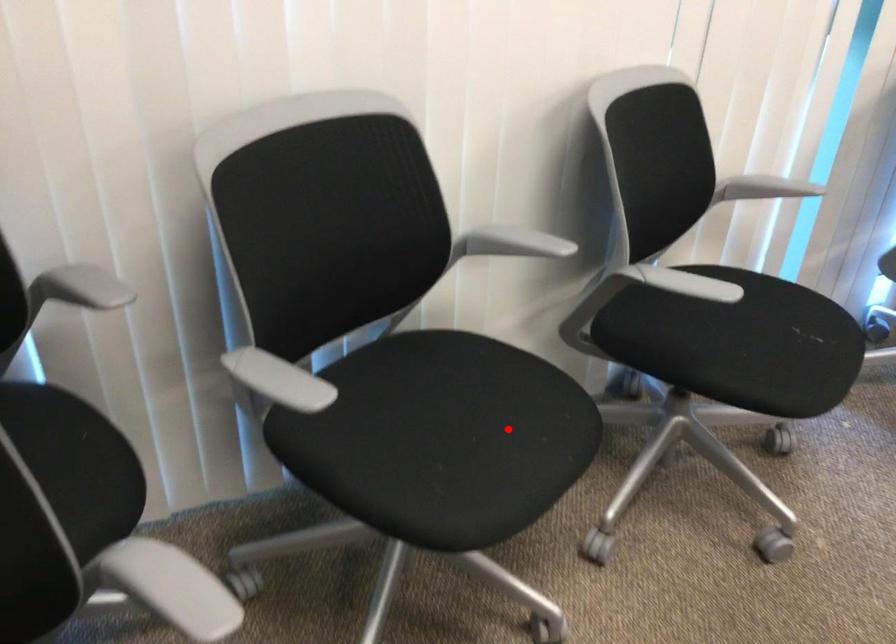
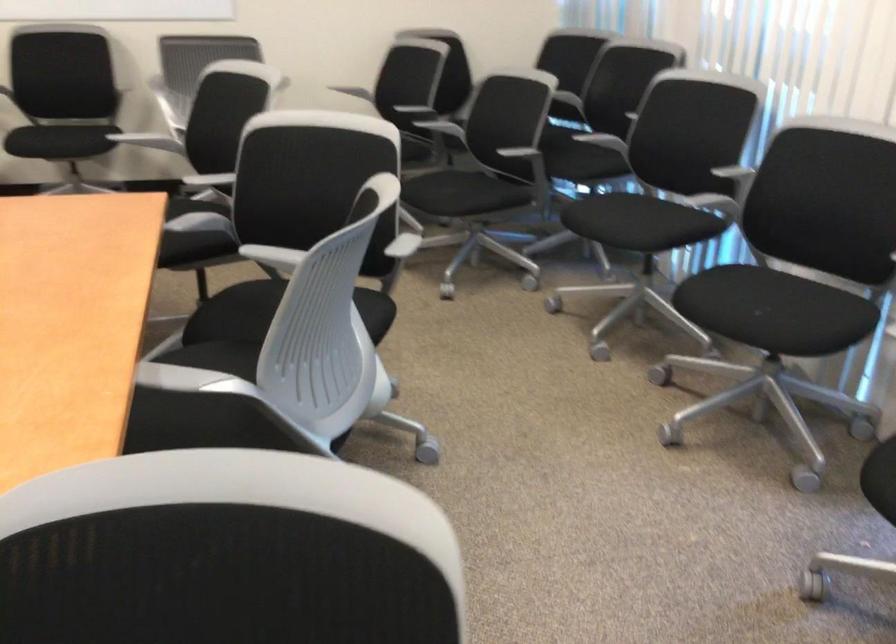
Question: I am providing you with two images of the same scene from different viewpoints. Image1 has a red point marked. In image2, the corresponding 3D location appears at what relative position? Reply with the corresponding letter.

Choices:
 (A) Closer
 (B) Farther

Answer: (B)